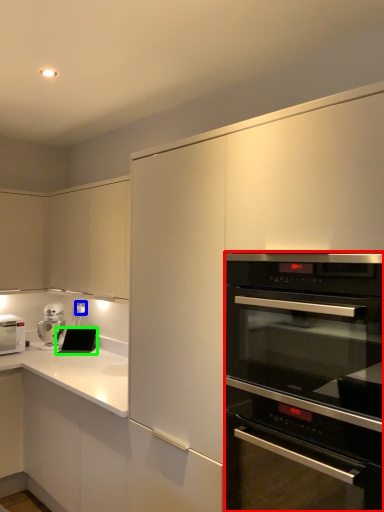
Question: Estimate the real-world distances between objects in this image. Which object is farther from oven (highlighted by a red box), electric outlet (highlighted by a blue box) or appliance (highlighted by a green box)?

Choices:
 (A) electric outlet
 (B) appliance

Answer: (A)